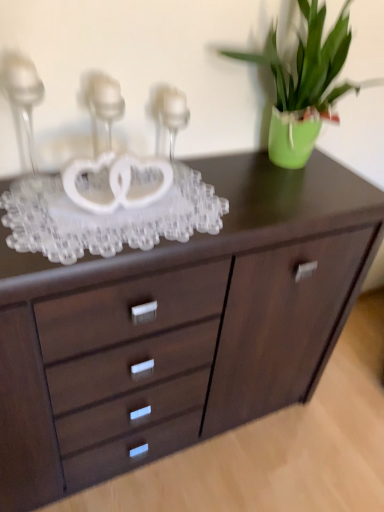
The image size is (384, 512). In order to click on free spot to the right of clear glass candle holder at upper left, the 2th candle holder positioned from the left in this screenshot , I will do `click(178, 192)`.